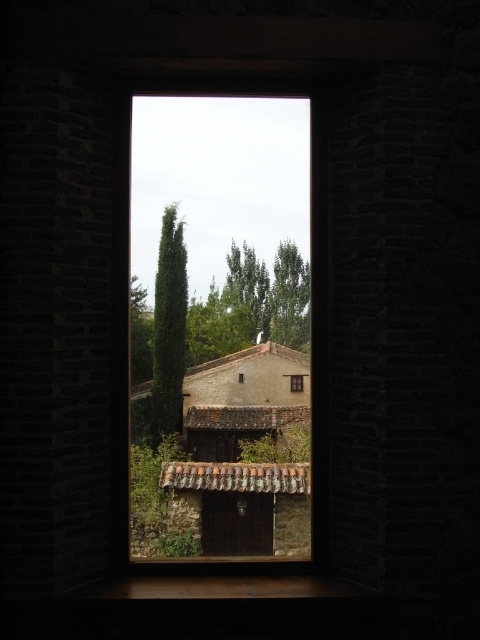
Consider the image. You are an architect designing a new building and want to ensure that the brown stone window at center and the green leafy tree at upper center are proportionally balanced. Based on the scene, which object should be adjusted in size if you want them to have equal width?

The brown stone window at center is wider than green leafy tree at upper center, so the green leafy tree at upper center should be made wider to match the window.

You are standing outside the building and want to enter through the dark wooden door. To do so, you need to walk past the green leafy tree at upper center and the matte brown wooden window at center. Which object should you avoid hitting your head on?

The green leafy tree at upper center is in front of the matte brown wooden window at center, so you should avoid hitting your head on the green leafy tree at upper center as it is closer to you.